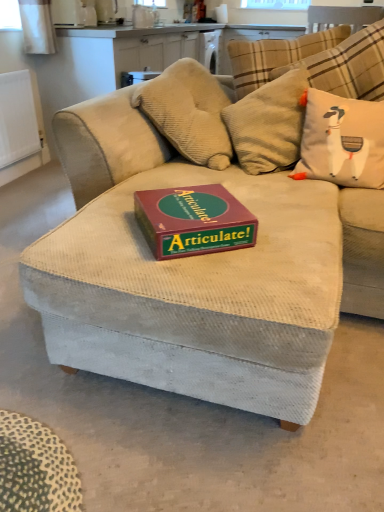
Question: From the image's perspective, is maroon cardboard articulate! game box on the center over white fabric pillow with cartoon llama at upper right?

Choices:
 (A) no
 (B) yes

Answer: (A)

Question: Does maroon cardboard articulate! game box on the center have a greater height compared to white fabric pillow with cartoon llama at upper right?

Choices:
 (A) yes
 (B) no

Answer: (B)

Question: Could you tell me if maroon cardboard articulate! game box on the center is facing white fabric pillow with cartoon llama at upper right?

Choices:
 (A) no
 (B) yes

Answer: (A)

Question: Is maroon cardboard articulate! game box on the center looking in the opposite direction of white fabric pillow with cartoon llama at upper right?

Choices:
 (A) no
 (B) yes

Answer: (A)

Question: Is maroon cardboard articulate! game box on the center in contact with white fabric pillow with cartoon llama at upper right?

Choices:
 (A) yes
 (B) no

Answer: (B)

Question: From the image's perspective, does maroon cardboard articulate! game box on the center appear lower than white fabric pillow with cartoon llama at upper right?

Choices:
 (A) yes
 (B) no

Answer: (A)

Question: Is white fabric pillow with cartoon llama at upper right facing away from maroon cardboard articulate! game box on the center?

Choices:
 (A) no
 (B) yes

Answer: (A)

Question: From the image's perspective, is white fabric pillow with cartoon llama at upper right on maroon cardboard articulate! game box on the center?

Choices:
 (A) yes
 (B) no

Answer: (A)

Question: From a real-world perspective, is white fabric pillow with cartoon llama at upper right positioned over maroon cardboard articulate! game box on the center based on gravity?

Choices:
 (A) no
 (B) yes

Answer: (B)

Question: Is maroon cardboard articulate! game box on the center surrounded by white fabric pillow with cartoon llama at upper right?

Choices:
 (A) yes
 (B) no

Answer: (B)

Question: Does white fabric pillow with cartoon llama at upper right have a lesser height compared to maroon cardboard articulate! game box on the center?

Choices:
 (A) no
 (B) yes

Answer: (A)

Question: Is white fabric pillow with cartoon llama at upper right positioned beyond the bounds of maroon cardboard articulate! game box on the center?

Choices:
 (A) yes
 (B) no

Answer: (A)

Question: From a real-world perspective, is white matte radiator at left located higher than white fabric pillow with cartoon llama at upper right?

Choices:
 (A) yes
 (B) no

Answer: (B)